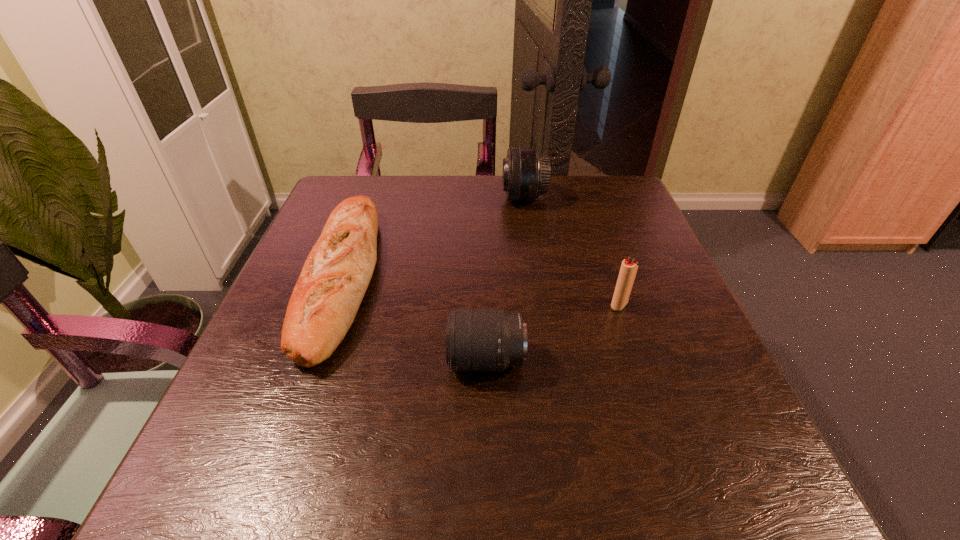
The image size is (960, 540). What are the coordinates of `the farther telephoto lens` in the screenshot? It's located at (526, 173).

This screenshot has width=960, height=540. What are the coordinates of `the taller telephoto lens` in the screenshot? It's located at pyautogui.click(x=526, y=173).

You are a GUI agent. You are given a task and a screenshot of the screen. Output one action in this format:
    pyautogui.click(x=<x>, y=<y>)
    Task: Click on the igniter
    This screenshot has width=960, height=540.
    Given the screenshot: What is the action you would take?
    pyautogui.click(x=629, y=267)

This screenshot has width=960, height=540. Identify the location of the shorter telephoto lens. (476, 339).

You are a GUI agent. You are given a task and a screenshot of the screen. Output one action in this format:
    pyautogui.click(x=<x>, y=<y>)
    Task: Click on the leftmost object
    
    Given the screenshot: What is the action you would take?
    pyautogui.click(x=336, y=274)

What are the coordinates of `vacant region located on the front-facing side of the farthest object` in the screenshot? It's located at [x=352, y=198].

Identify the location of vacant space positioned on the front-facing side of the farthest object. The width and height of the screenshot is (960, 540). (416, 198).

Find the location of a particular element. The height and width of the screenshot is (540, 960). vacant space located on the front-facing side of the farthest object is located at coordinates (408, 198).

The width and height of the screenshot is (960, 540). Identify the location of free space located on the back of the rightmost object. (581, 192).

Where is `free space located 0.320m on the surface of the shorter telephoto lens`? free space located 0.320m on the surface of the shorter telephoto lens is located at coordinates (256, 360).